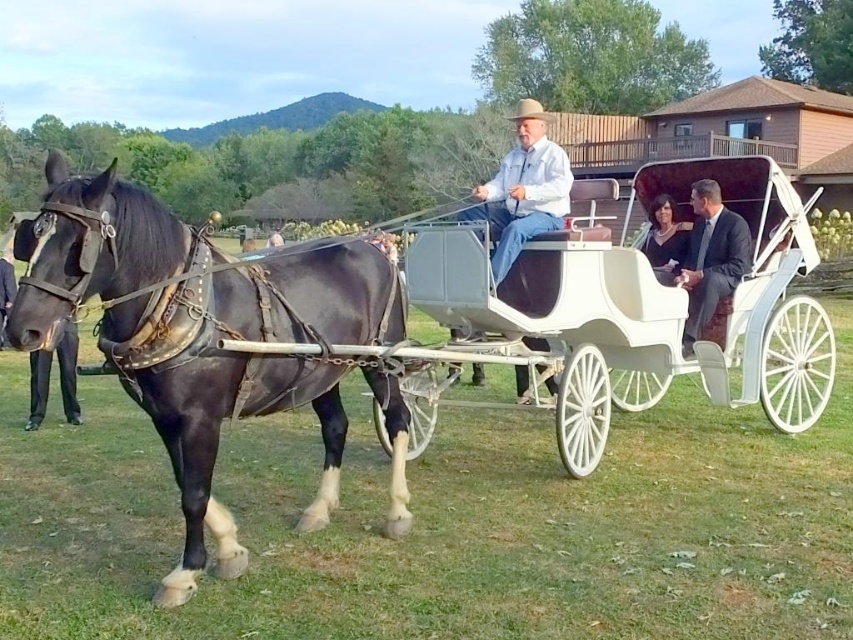
Question: Considering the real-world distances, which object is closest to the dark gray suit at center?

Choices:
 (A) shiny black horse at left
 (B) black satin dress at center
 (C) light brown leather hat at center

Answer: (B)

Question: Is shiny black horse at left closer to camera compared to light brown leather hat at center?

Choices:
 (A) yes
 (B) no

Answer: (A)

Question: Which object is positioned farthest from the shiny black horse at left?

Choices:
 (A) light brown leather hat at center
 (B) dark gray suit at center
 (C) black satin dress at center

Answer: (A)

Question: Does shiny black horse at left appear under black satin dress at center?

Choices:
 (A) yes
 (B) no

Answer: (A)

Question: Which is farther from the light brown leather hat at center?

Choices:
 (A) dark gray suit at center
 (B) shiny black horse at left
 (C) black satin dress at center

Answer: (B)

Question: Does shiny black horse at left appear on the right side of black satin dress at center?

Choices:
 (A) no
 (B) yes

Answer: (A)